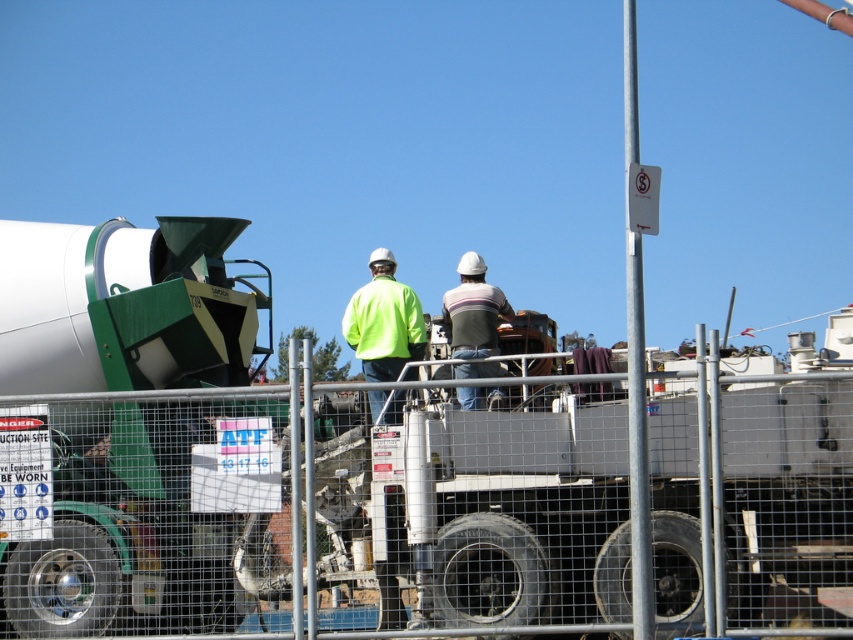
Question: Can you confirm if silver metallic pole at upper center is positioned to the left of neon yellow jacket at center?

Choices:
 (A) no
 (B) yes

Answer: (A)

Question: Is silver metallic pole at upper center to the left of neon yellow jacket at center from the viewer's perspective?

Choices:
 (A) no
 (B) yes

Answer: (A)

Question: Does neon yellow jacket at center have a greater width compared to striped cotton shirt at center?

Choices:
 (A) no
 (B) yes

Answer: (B)

Question: Among these objects, which one is farthest from the camera?

Choices:
 (A) silver metallic pole at upper center
 (B) striped cotton shirt at center
 (C) neon yellow jacket at center

Answer: (B)

Question: Which object is positioned closest to the neon yellow jacket at center?

Choices:
 (A) silver metallic pole at upper center
 (B) striped cotton shirt at center

Answer: (B)

Question: Which object appears closest to the camera in this image?

Choices:
 (A) neon yellow jacket at center
 (B) striped cotton shirt at center
 (C) silver metallic pole at upper center

Answer: (C)